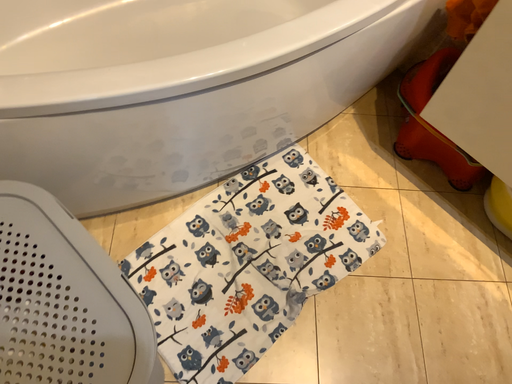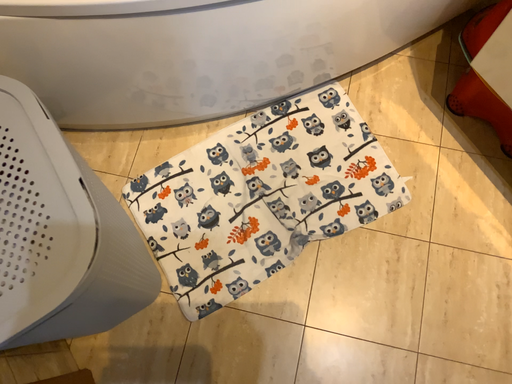
Question: Which way did the camera rotate in the video?

Choices:
 (A) rotated left
 (B) rotated right

Answer: (A)